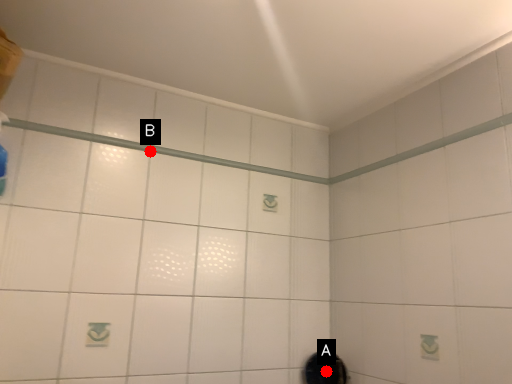
Question: Two points are circled on the image, labeled by A and B beside each circle. Which of the following is the farthest from the observer?

Choices:
 (A) A is further
 (B) B is further

Answer: (A)